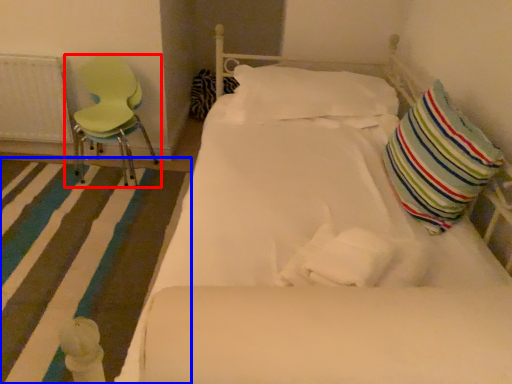
Question: Among these objects, which one is farthest to the camera, chair (highlighted by a red box) or strip (highlighted by a blue box)?

Choices:
 (A) chair
 (B) strip

Answer: (A)